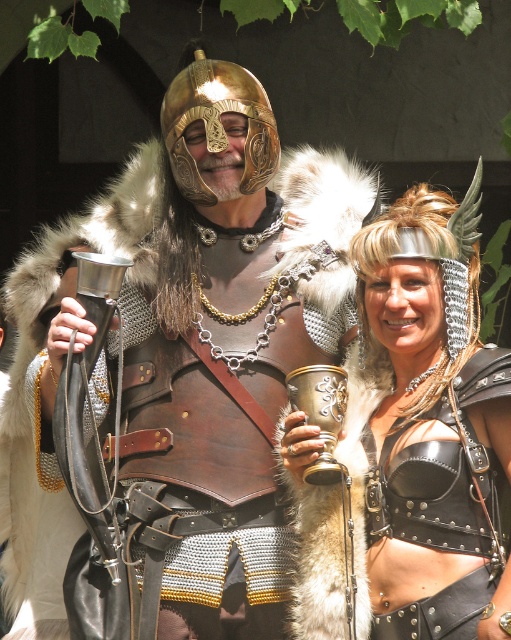
From the picture: Who is taller, polished brass helmet at center or shiny gold cup at center?

polished brass helmet at center is taller.

Can you confirm if polished brass helmet at center is smaller than shiny gold cup at center?

No.

In order to click on polished brass helmet at center in this screenshot , I will do (x=190, y=380).